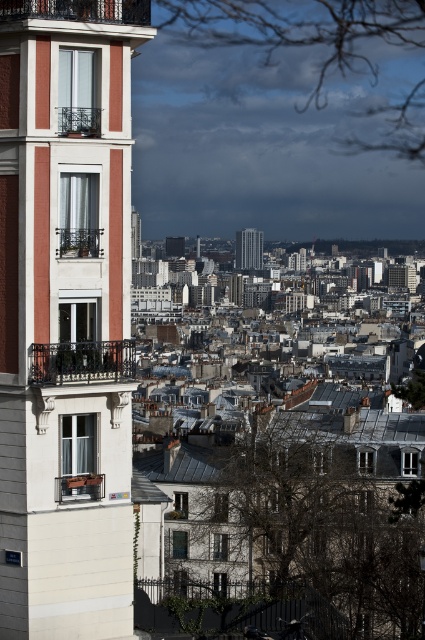
Question: Among these objects, which one is nearest to the camera?

Choices:
 (A) matte wood balcony at lower left
 (B) matte white balcony at left
 (C) silver metallic skyscraper at center

Answer: (B)

Question: Can you confirm if black wrought iron balcony at left is positioned to the right of matte white balcony at upper left?

Choices:
 (A) no
 (B) yes

Answer: (B)

Question: Which is nearer to the matte wood balcony at lower left?

Choices:
 (A) matte white balcony at left
 (B) black wrought iron balcony at left
 (C) silver metallic skyscraper at center

Answer: (B)

Question: Can you confirm if matte white balcony at left is positioned to the right of silver metallic skyscraper at center?

Choices:
 (A) no
 (B) yes

Answer: (A)

Question: Among these points, which one is nearest to the camera?

Choices:
 (A) (64, 248)
 (B) (79, 356)
 (C) (51, 637)
 (D) (248, 250)

Answer: (C)

Question: Considering the relative positions of matte white balcony at upper left and silver metallic skyscraper at center in the image provided, where is matte white balcony at upper left located with respect to silver metallic skyscraper at center?

Choices:
 (A) above
 (B) below

Answer: (B)